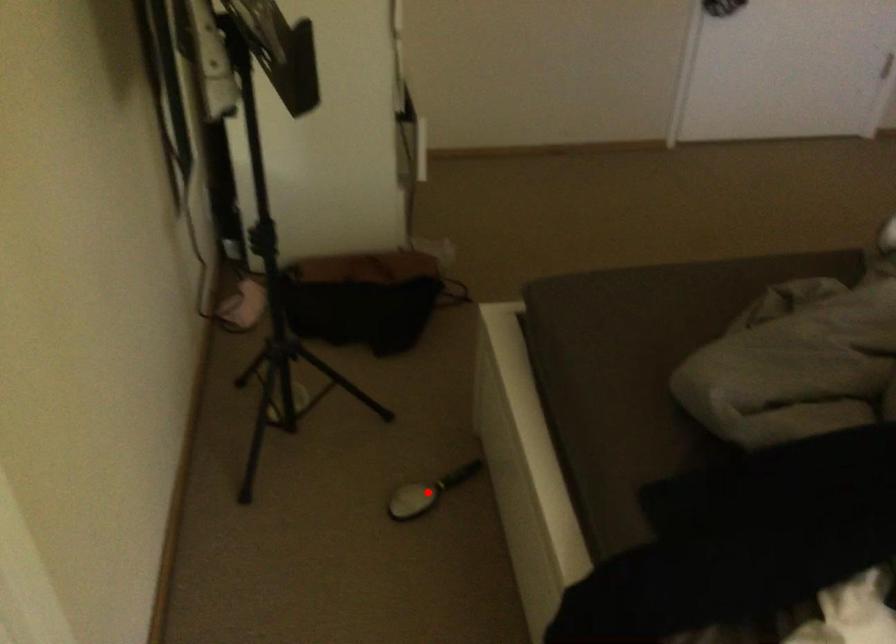
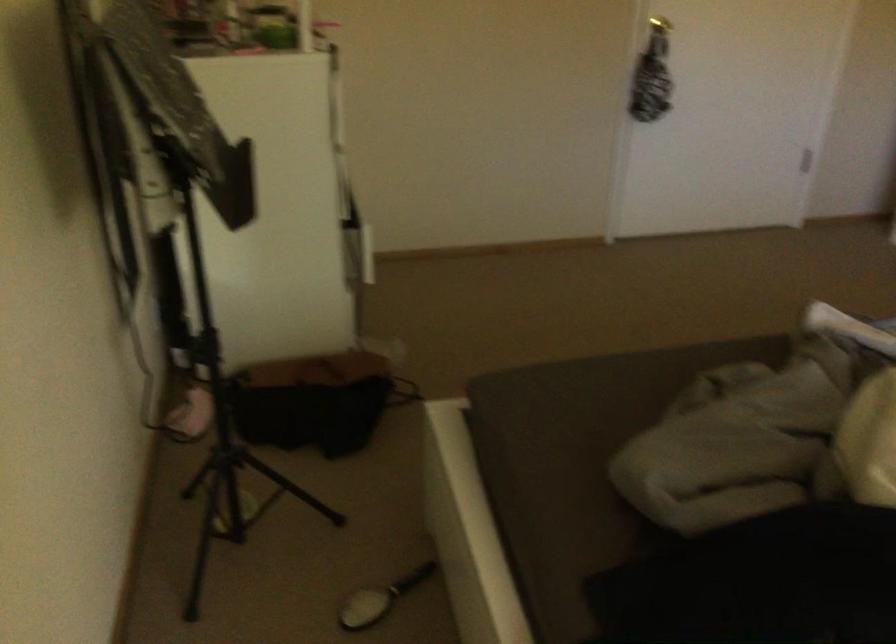
Find the pixel in the second image that matches the highlighted location in the first image.

(380, 599)